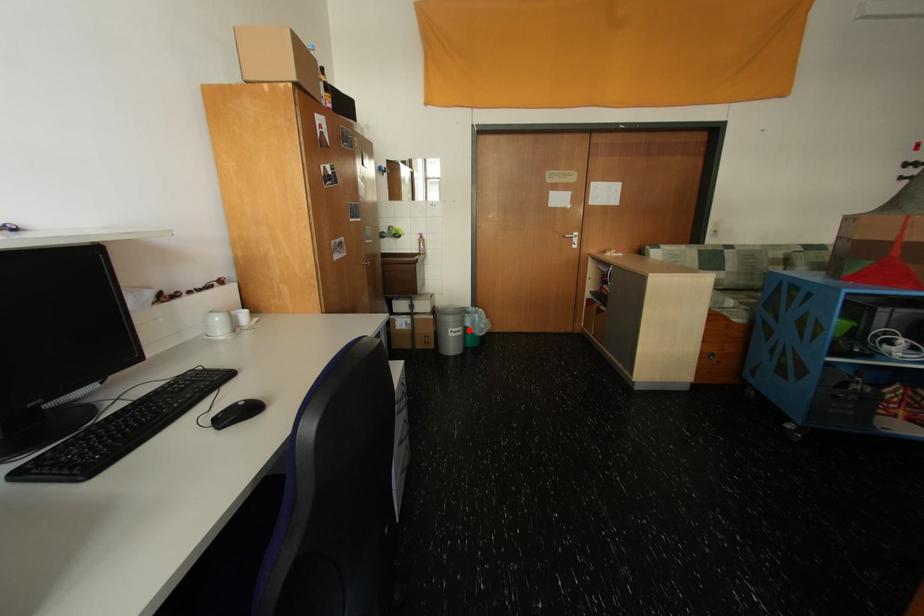
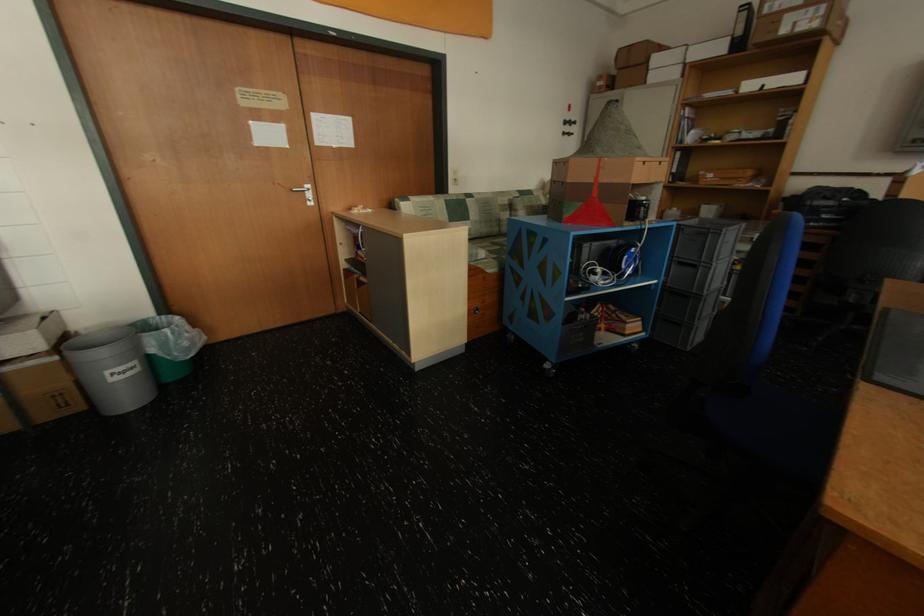
In the second image, find the point that corresponds to the highlighted location in the first image.

(142, 363)